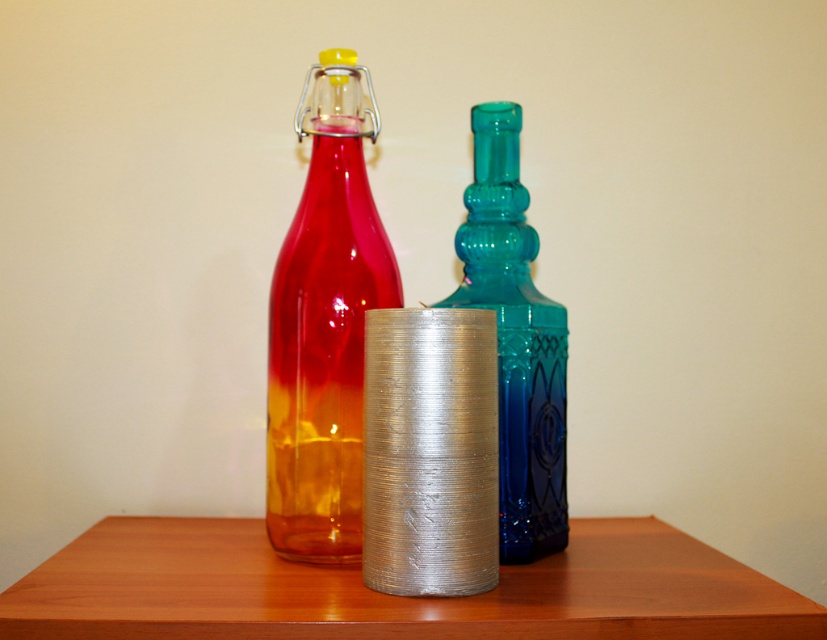
Question: Among these points, which one is nearest to the camera?

Choices:
 (A) (314, 499)
 (B) (548, 436)
 (C) (108, 618)

Answer: (C)

Question: Is wooden table at center below translucent blue glass bottle at center?

Choices:
 (A) no
 (B) yes

Answer: (B)

Question: Does wooden table at center have a smaller size compared to translucent amber glass bottle at center?

Choices:
 (A) yes
 (B) no

Answer: (B)

Question: From the image, what is the correct spatial relationship of wooden table at center in relation to translucent blue glass bottle at center?

Choices:
 (A) below
 (B) above

Answer: (A)

Question: Estimate the real-world distances between objects in this image. Which object is closer to the translucent blue glass bottle at center?

Choices:
 (A) wooden table at center
 (B) translucent amber glass bottle at center

Answer: (B)

Question: Among these points, which one is nearest to the camera?

Choices:
 (A) (533, 352)
 (B) (349, 250)

Answer: (A)